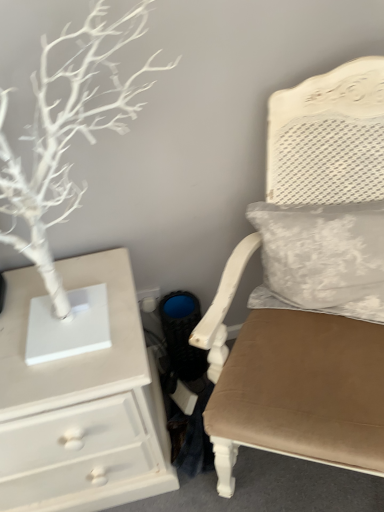
Identify the location of free spot below white matte tree at left (from a real-world perspective). The height and width of the screenshot is (512, 384). (72, 332).